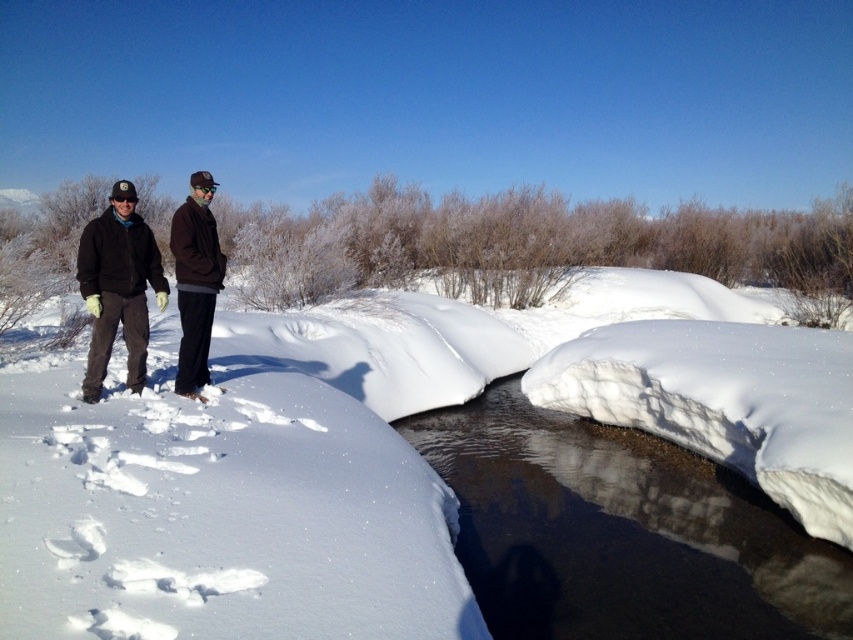
Question: Does white fluffy snow at center have a lesser width compared to dark brown jacket at center?

Choices:
 (A) yes
 (B) no

Answer: (B)

Question: Does white fluffy snow at center appear over dark brown jacket at left?

Choices:
 (A) yes
 (B) no

Answer: (B)

Question: Considering the relative positions of white fluffy snow at center and white ice stream at center in the image provided, where is white fluffy snow at center located with respect to white ice stream at center?

Choices:
 (A) below
 (B) above

Answer: (B)

Question: Which object appears closest to the camera in this image?

Choices:
 (A) dark brown jacket at center
 (B) white ice stream at center
 (C) white fluffy snow at center
 (D) dark brown jacket at left

Answer: (C)

Question: Which object is farther from the camera taking this photo?

Choices:
 (A) white fluffy snow at center
 (B) white ice stream at center

Answer: (B)

Question: Which point appears closest to the camera in this image?

Choices:
 (A) (142, 308)
 (B) (381, 458)
 (C) (180, 282)

Answer: (B)